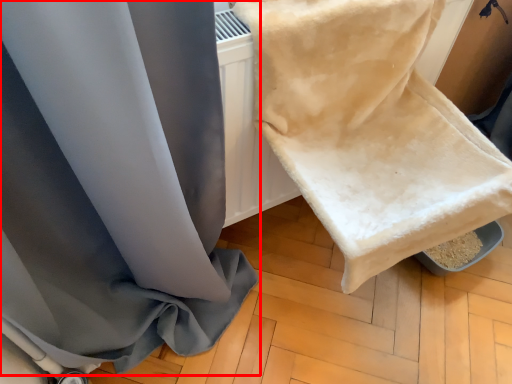
Question: From the image's perspective, what is the correct spatial positioning of curtain (annotated by the red box) in reference to towel?

Choices:
 (A) above
 (B) below

Answer: (B)